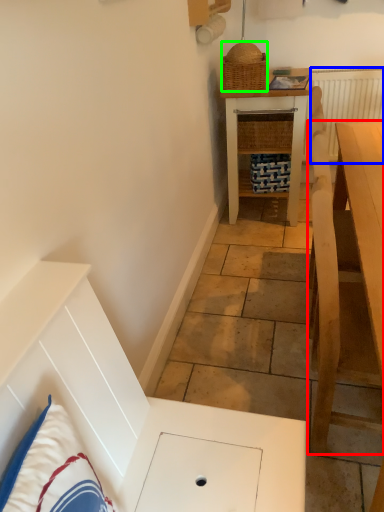
Question: Which object is positioned farthest from table (highlighted by a red box)? Select from radiator (highlighted by a blue box) and picnic basket (highlighted by a green box).

Choices:
 (A) radiator
 (B) picnic basket

Answer: (A)